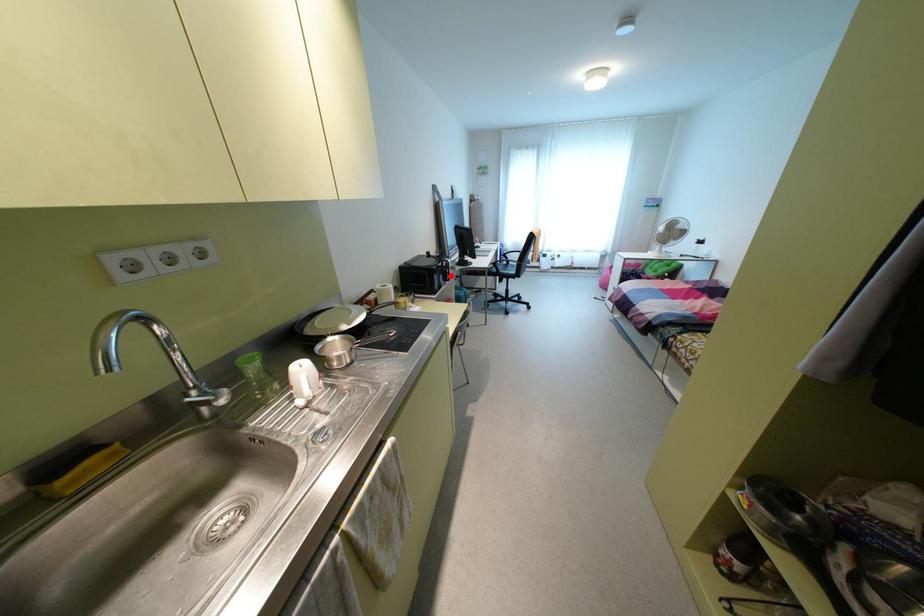
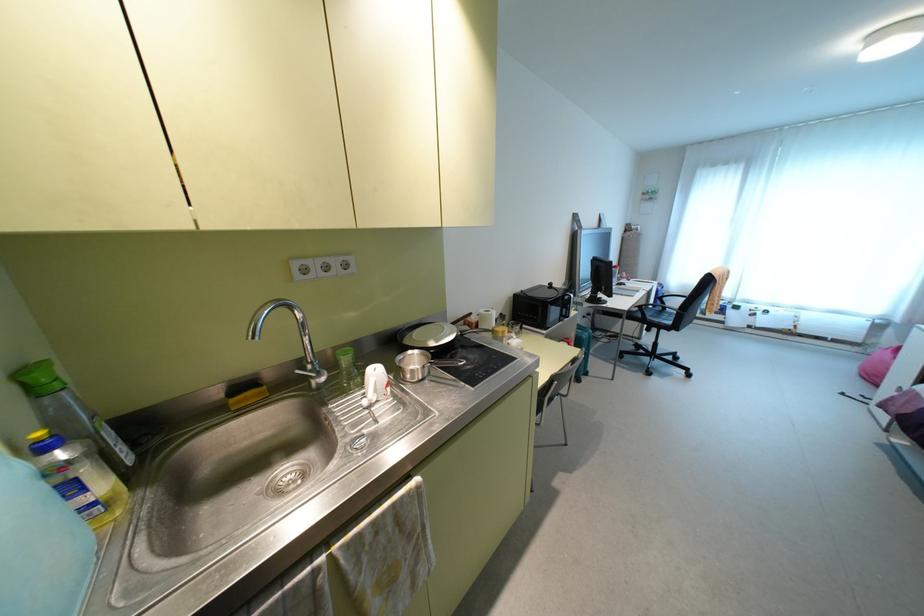
Question: I am providing you with two images of the same scene from different viewpoints. Given a red point in image1, look at the same physical point in image2. Is it:

Choices:
 (A) Closer to the viewpoint
 (B) Farther from the viewpoint

Answer: (B)